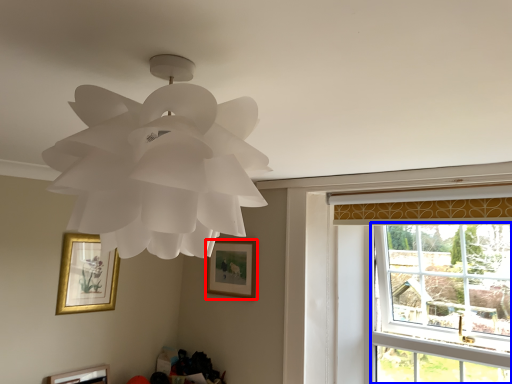
Question: Which point is closer to the camera, picture frame (highlighted by a red box) or window (highlighted by a blue box)?

Choices:
 (A) picture frame
 (B) window

Answer: (B)